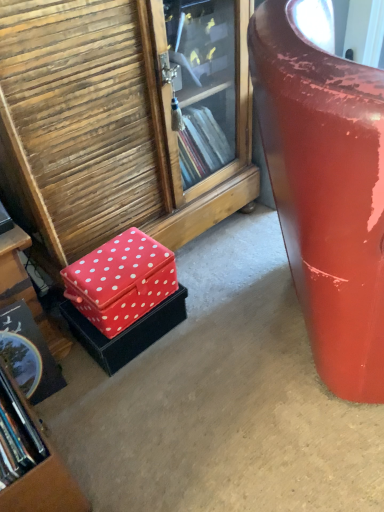
Locate an element on the screen. The image size is (384, 512). vacant space in front of red fabric box at lower left, which ranks as the first box in bottom-to-top order is located at coordinates (134, 400).